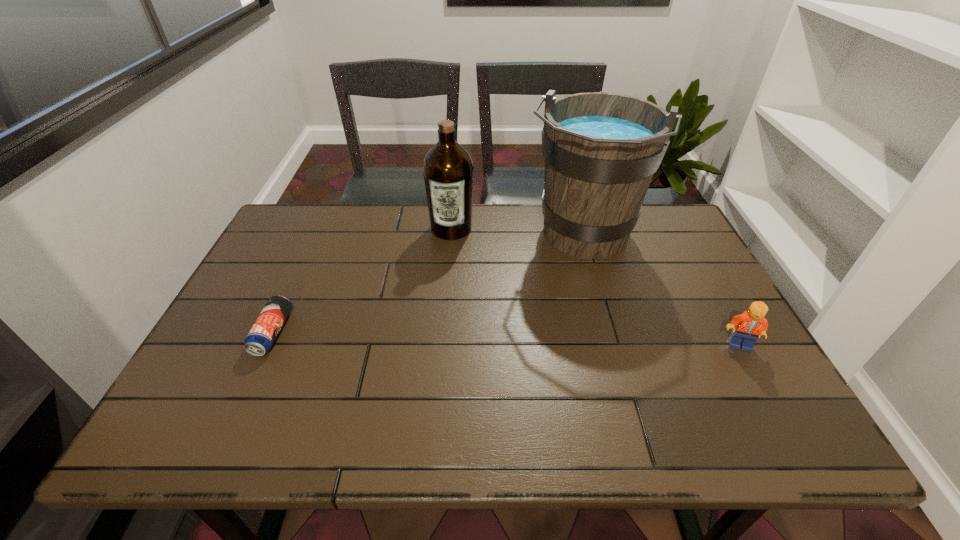
Identify the location of the shortest object. This screenshot has height=540, width=960. (260, 339).

The height and width of the screenshot is (540, 960). Find the location of `the leftmost object`. the leftmost object is located at coordinates (260, 339).

Where is `the rightmost object`? the rightmost object is located at coordinates pyautogui.click(x=750, y=325).

The width and height of the screenshot is (960, 540). I want to click on the third tallest object, so tap(750, 325).

I want to click on olive oil, so click(x=448, y=170).

Identify the location of the second tallest object. (448, 170).

Identify the location of wine bucket. (601, 150).

The height and width of the screenshot is (540, 960). I want to click on the tallest object, so click(x=601, y=150).

Locate an element on the screen. Image resolution: width=960 pixels, height=540 pixels. free space located on the right of the beer can is located at coordinates click(332, 333).

Find the location of a particular element. This screenshot has width=960, height=540. vacant point located 0.080m on the front-facing side of the Lego is located at coordinates (759, 381).